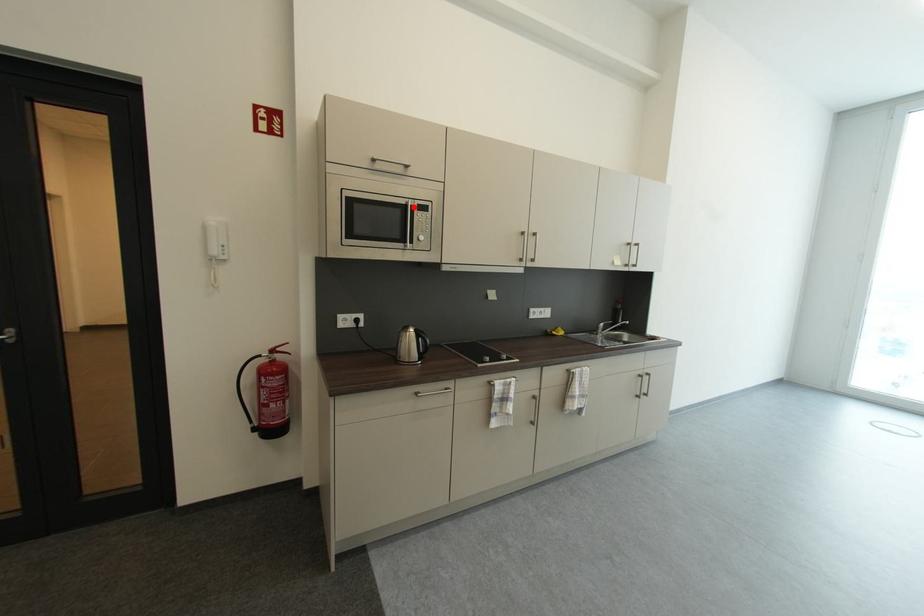
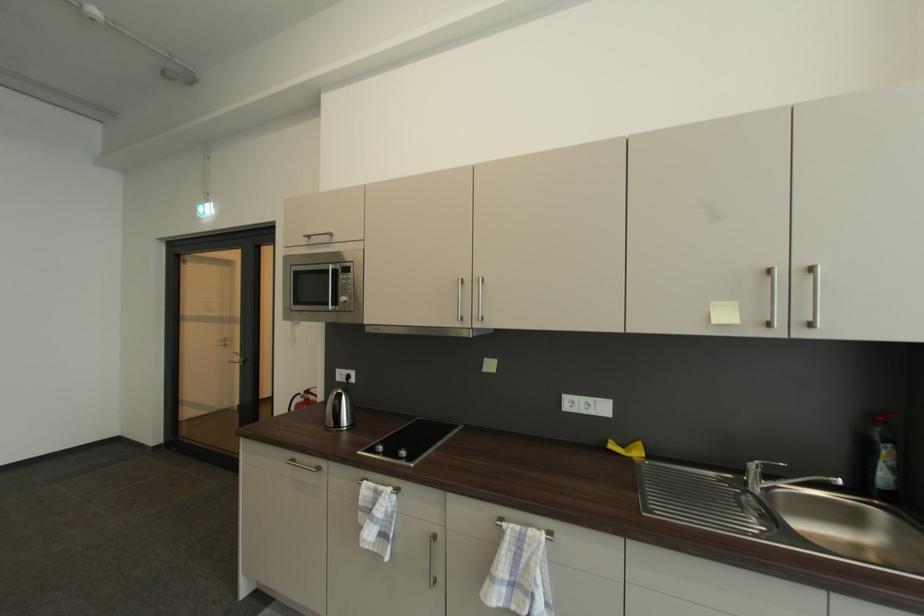
Find the pixel in the second image that matches the highlighted location in the first image.

(334, 272)